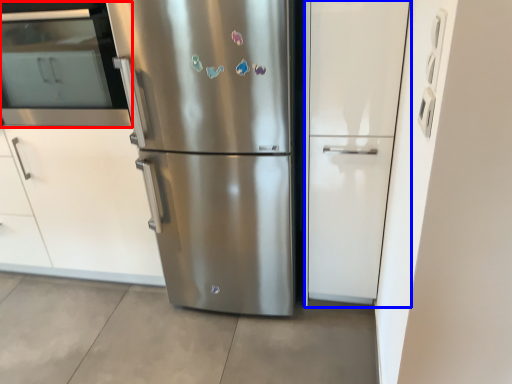
Question: Which point is closer to the camera, oven (highlighted by a red box) or glass door (highlighted by a blue box)?

Choices:
 (A) oven
 (B) glass door

Answer: (B)